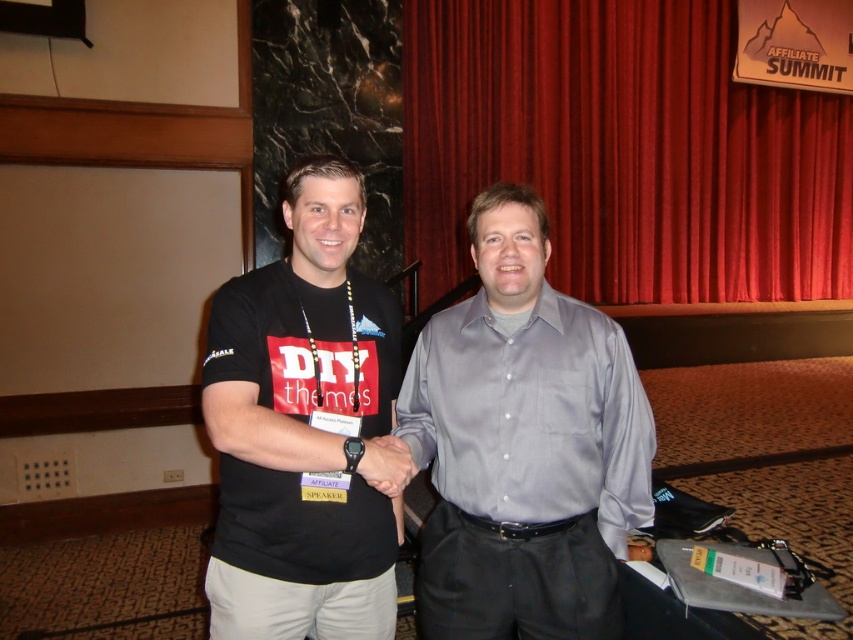
Is gray satin shirt at center positioned behind black matte t-shirt at center?

Yes.

Is gray satin shirt at center wider than black matte t-shirt at center?

Yes.

Between point (579, 429) and point (350, 291), which one is positioned in front?

Point (579, 429)

Find the location of `gray satin shirt at center`. gray satin shirt at center is located at coordinates (524, 444).

Is black matte t-shirt at center taller than matte black hand at center?

Yes.

Which of these two, black matte t-shirt at center or matte black hand at center, stands taller?

With more height is black matte t-shirt at center.

Measure the distance between point (317, 429) and camera.

1.19 meters

Where is `black matte t-shirt at center`? This screenshot has width=853, height=640. black matte t-shirt at center is located at coordinates (x=303, y=428).

Between point (444, 413) and point (389, 477), which one is positioned in front?

Point (389, 477) is more forward.

This screenshot has height=640, width=853. I want to click on gray satin shirt at center, so click(x=524, y=444).

Locate an element on the screen. gray satin shirt at center is located at coordinates (524, 444).